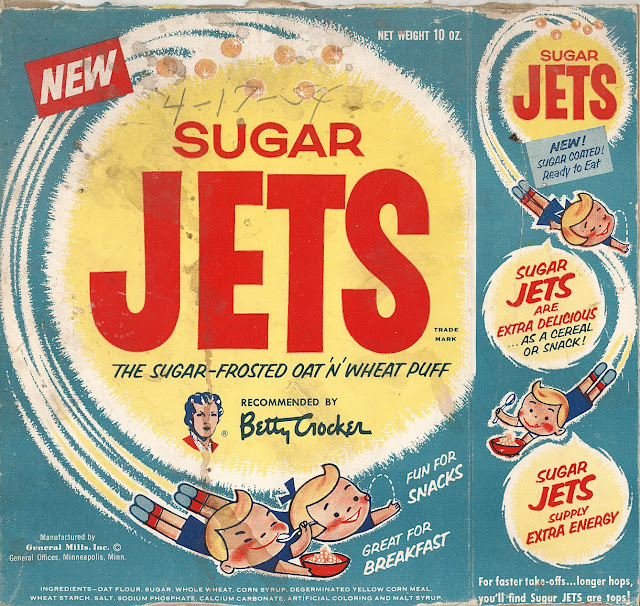
The width and height of the screenshot is (640, 606). Identify the location of cereal box. (299, 10).